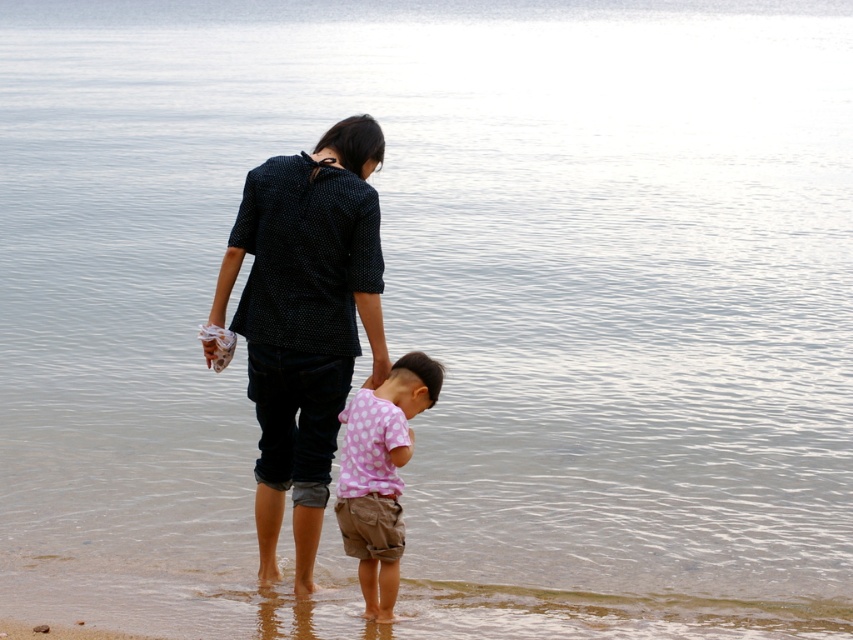
What is the 2D coordinate of the black dotted shirt at center?

The 2D coordinate of the black dotted shirt at center is at point (305, 320).

You are a photographer trying to capture a photo of the black dotted shirt at center and the pink dotted shirt at lower center. Which one is positioned higher in the image?

The black dotted shirt at center is located above the pink dotted shirt at lower center, so it is positioned higher in the image.